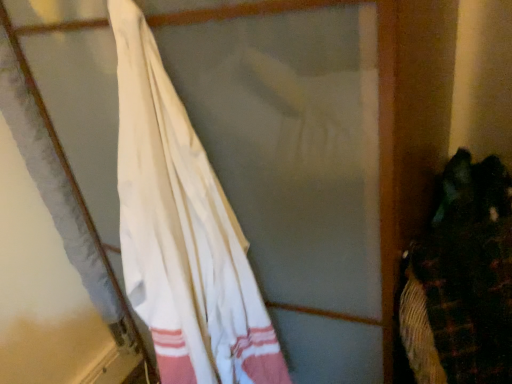
Question: Does white cotton towel at left have a smaller size compared to dark green fabric at right?

Choices:
 (A) no
 (B) yes

Answer: (A)

Question: Is dark green fabric at right located within white cotton towel at left?

Choices:
 (A) yes
 (B) no

Answer: (B)

Question: Is white cotton towel at left far from dark green fabric at right?

Choices:
 (A) no
 (B) yes

Answer: (A)

Question: Is white cotton towel at left wider than dark green fabric at right?

Choices:
 (A) no
 (B) yes

Answer: (A)

Question: Is the depth of white cotton towel at left greater than that of dark green fabric at right?

Choices:
 (A) no
 (B) yes

Answer: (A)

Question: Does white cotton towel at left turn towards dark green fabric at right?

Choices:
 (A) yes
 (B) no

Answer: (B)

Question: Considering the relative sizes of dark green fabric at right and white cotton towel at left in the image provided, is dark green fabric at right thinner than white cotton towel at left?

Choices:
 (A) no
 (B) yes

Answer: (A)

Question: Are dark green fabric at right and white cotton towel at left located far from each other?

Choices:
 (A) no
 (B) yes

Answer: (A)

Question: Is dark green fabric at right further to camera compared to white cotton towel at left?

Choices:
 (A) no
 (B) yes

Answer: (B)

Question: Does dark green fabric at right appear on the right side of white cotton towel at left?

Choices:
 (A) no
 (B) yes

Answer: (B)

Question: Considering the relative sizes of dark green fabric at right and white cotton towel at left in the image provided, is dark green fabric at right wider than white cotton towel at left?

Choices:
 (A) yes
 (B) no

Answer: (A)

Question: Can you confirm if dark green fabric at right is positioned to the left of white cotton towel at left?

Choices:
 (A) yes
 (B) no

Answer: (B)

Question: From a real-world perspective, is dark green fabric at right physically located above or below white cotton towel at left?

Choices:
 (A) above
 (B) below

Answer: (B)